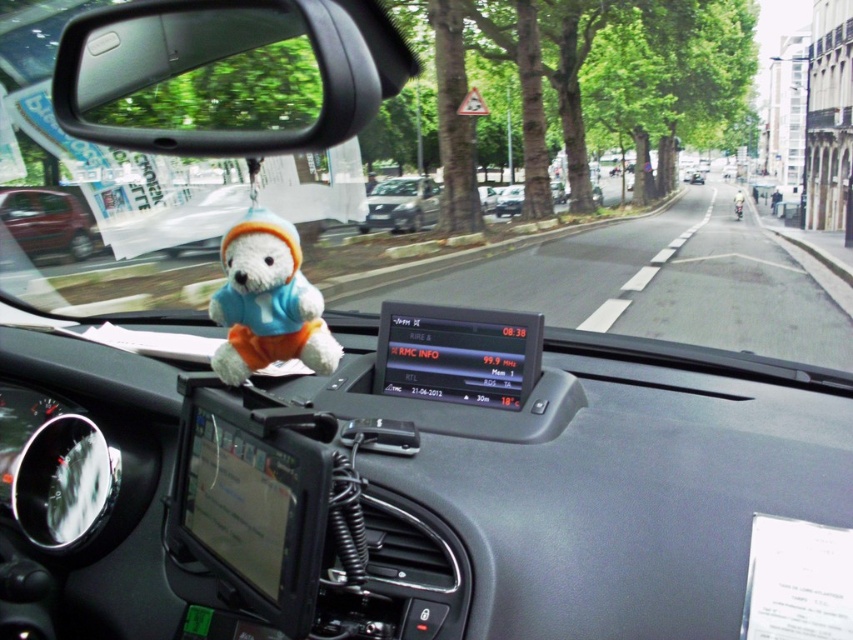
Is metallic red car at left further to camera compared to metallic silver car at center?

No, it is not.

Does metallic red car at left appear on the left side of metallic silver car at center?

Correct, you'll find metallic red car at left to the left of metallic silver car at center.

This screenshot has width=853, height=640. In order to click on metallic red car at left in this screenshot , I will do `click(48, 221)`.

The image size is (853, 640). I want to click on satin silver car at center, so click(x=401, y=204).

Does satin silver car at center appear under metallic silver car at center?

Yes.

Find the location of a particular element. satin silver car at center is located at coordinates (401, 204).

The image size is (853, 640). In order to click on satin silver car at center in this screenshot , I will do `click(401, 204)`.

Looking at this image, does transparent plastic view mirror at upper left appear under satin silver car at center?

Correct, transparent plastic view mirror at upper left is located below satin silver car at center.

Locate an element on the screen. This screenshot has width=853, height=640. transparent plastic view mirror at upper left is located at coordinates (215, 76).

Identify the location of transparent plastic view mirror at upper left. (215, 76).